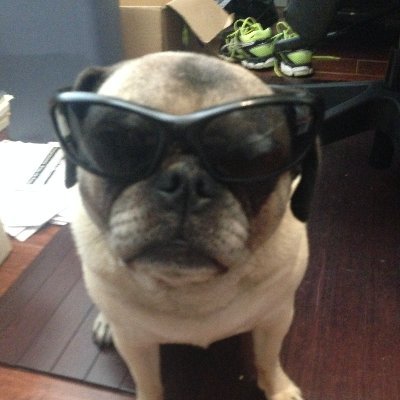
The width and height of the screenshot is (400, 400). I want to click on wooden board on floor, so click(55, 301).